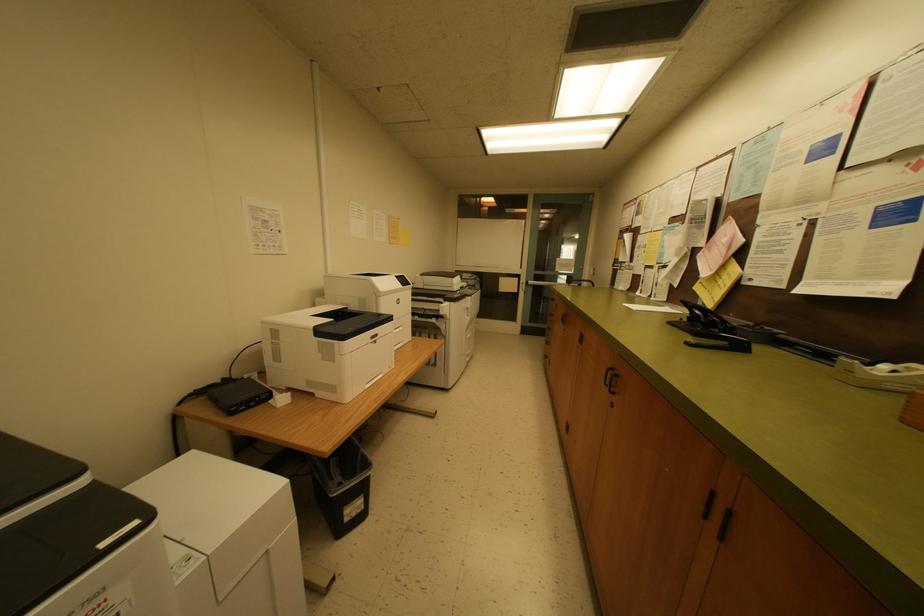
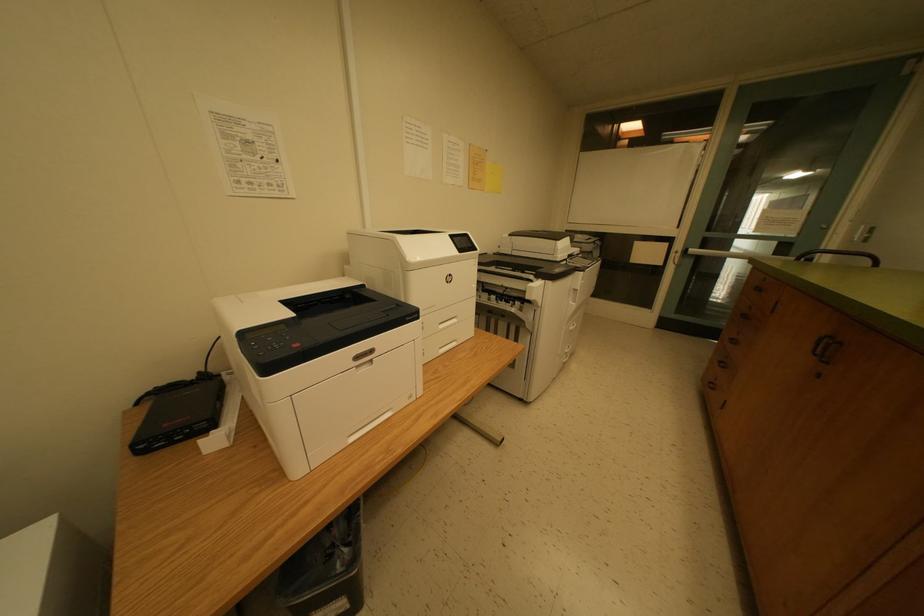
Question: The images are taken continuously from a first-person perspective. In which direction are you moving?

Choices:
 (A) Left
 (B) Right
 (C) Forward
 (D) Backward

Answer: (C)